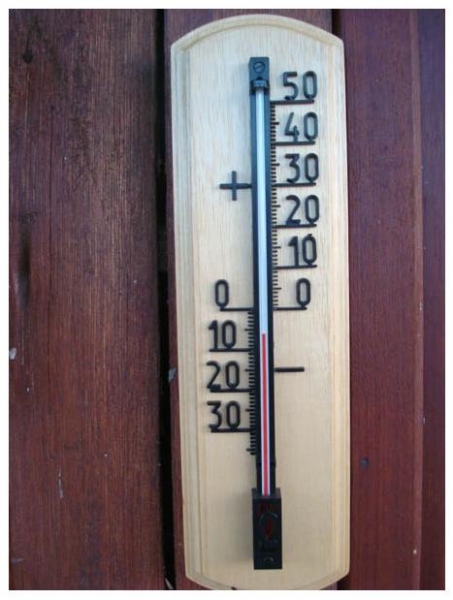
This screenshot has height=600, width=453. I want to click on wall, so click(365, 493).